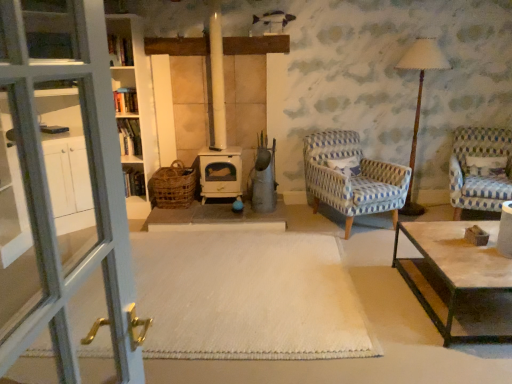
Image resolution: width=512 pixels, height=384 pixels. Identify the location of free spot above white carpet at center (from a real-world perspective). (231, 281).